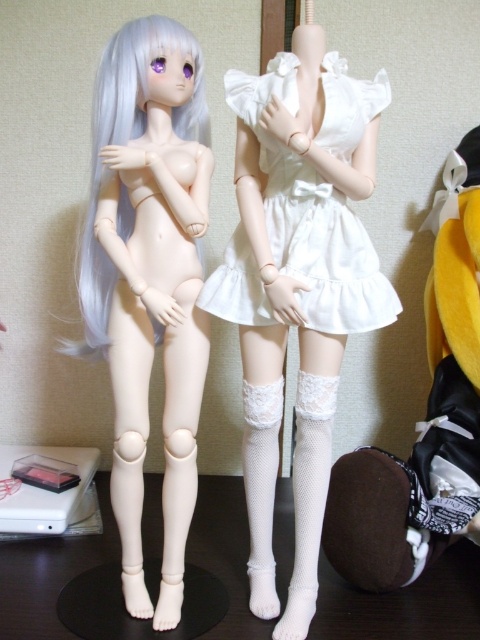
You are a doll collector examining the two dolls displayed against a beige wall. You notice the white satin dress at center and the white matte wig at upper left. Which object is positioned lower in the image?

The white satin dress at center is positioned lower than the white matte wig at upper left.

You are a collector examining two dolls displayed on a shelf. You notice the white lace socks at lower right and the white matte wig at upper left. Which object is located to the right of the other?

The white lace socks at lower right is positioned on the right side of white matte wig at upper left.

You are a photographer setting up a shot of the two dolls. You need to place a small light source between the two points, point (444, 296) and point (96, 193). Which point should the light be closer to so that it doesn not cast a shadow on the dolls?

The light should be placed closer to point (96, 193) because point (444, 296) is further away from the camera, so positioning the light closer to the nearer point would help avoid casting shadows on the dolls.